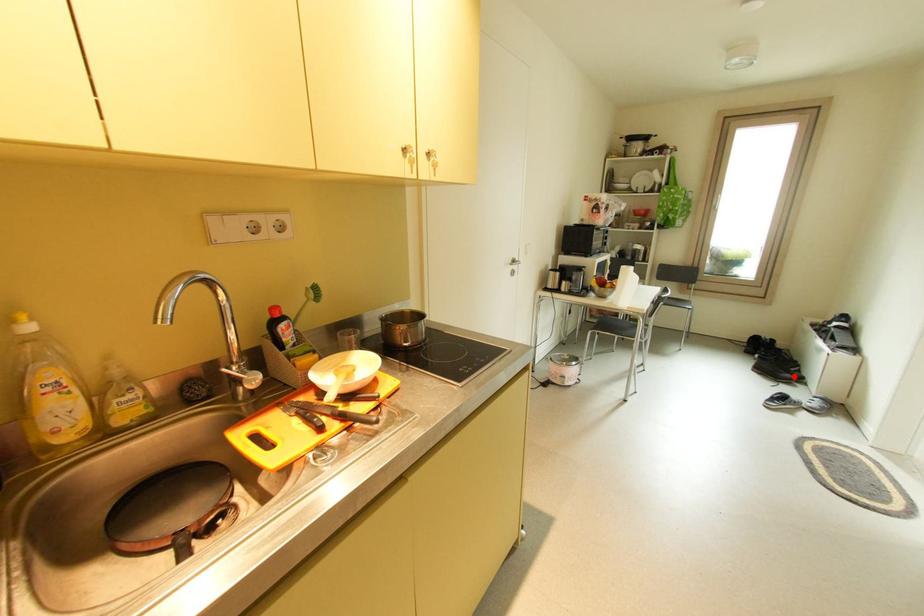
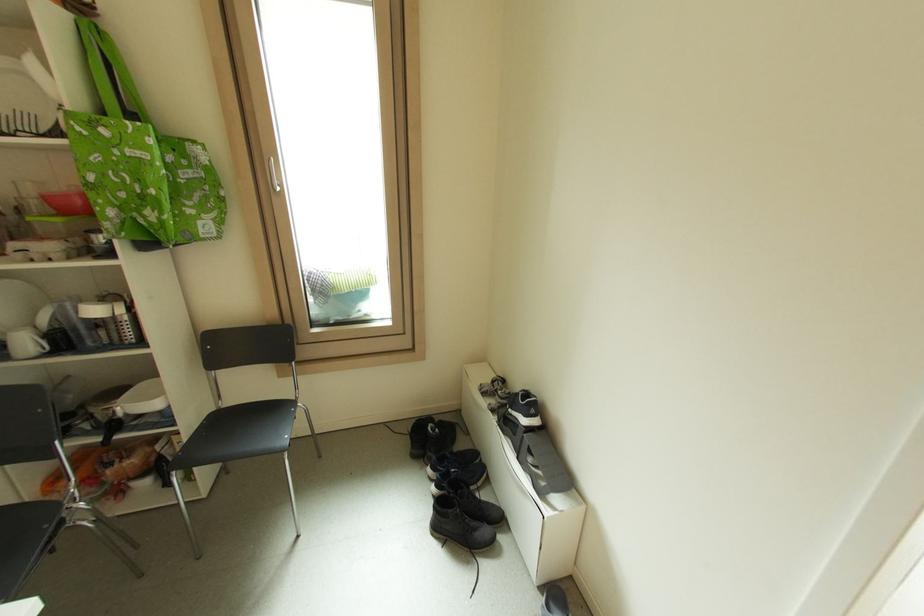
The point at the highlighted location is marked in the first image. Where is the corresponding point in the second image?

(490, 532)